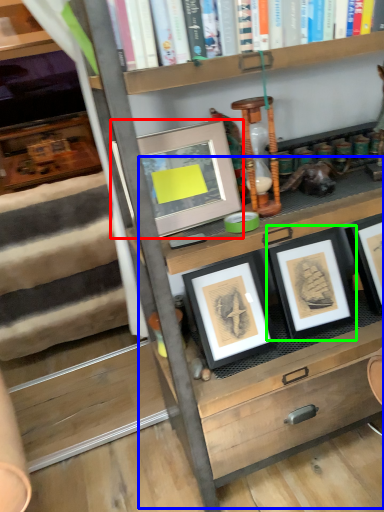
Question: Which is farther away from picture frame (highlighted by a red box)? table (highlighted by a blue box) or picture frame (highlighted by a green box)?

Choices:
 (A) table
 (B) picture frame

Answer: (A)